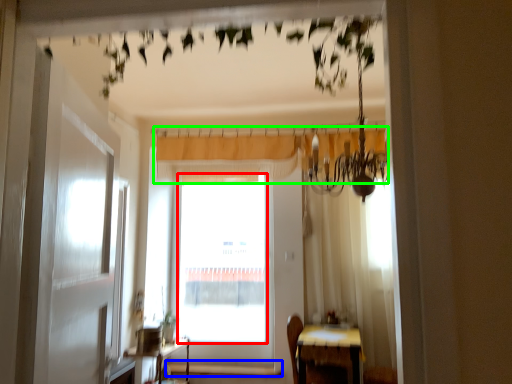
Question: Based on their relative distances, which object is farther from window screen (highlighted by a red box)? Choose from window sill (highlighted by a blue box) and curtain (highlighted by a green box).

Choices:
 (A) window sill
 (B) curtain

Answer: (B)